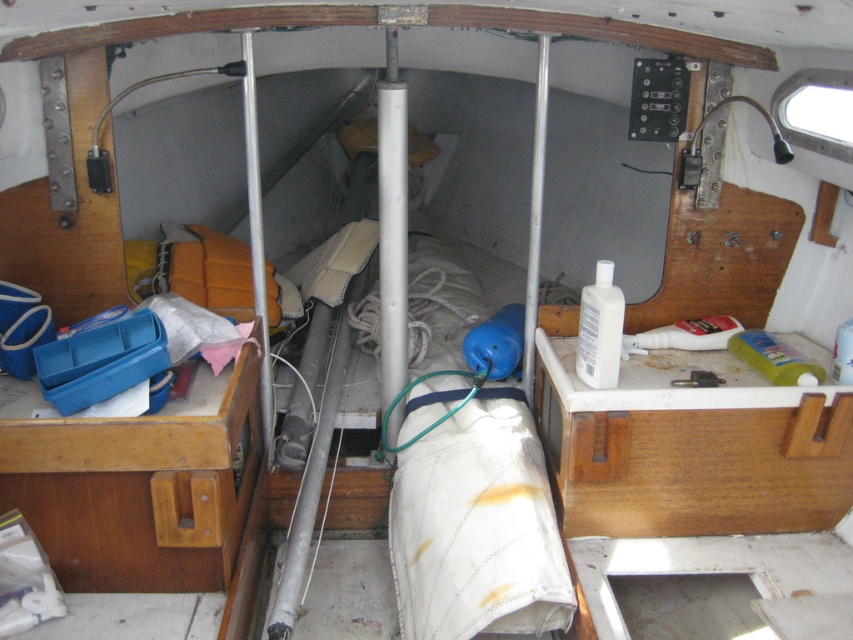
You are navigating inside the boat cabin and want to move from the front to the back. There are two points marked as point [64,422] and point [709,381]. Which point should you avoid stepping on to ensure you can move freely towards the back?

You should avoid stepping on point [709,381] because it is behind point [64,422]. Since you want to move towards the back, stepping on the point in front might block your path.

You are inside the boat cabin and need to place a small item exactly at point (x=141, y=486). Which object is located at that coordinate?

The point (x=141, y=486) is on the wooden drawer at left.

You are a sailor who needs to access both the wooden drawer at left and the metallic silver tool at center. Which object should you reach for first if you want to grab the one closer to you?

The wooden drawer at left is positioned on the left side of metallic silver tool at center, so if you are facing the cabin, the wooden drawer at left would be closer to your left hand, making it easier to reach first.